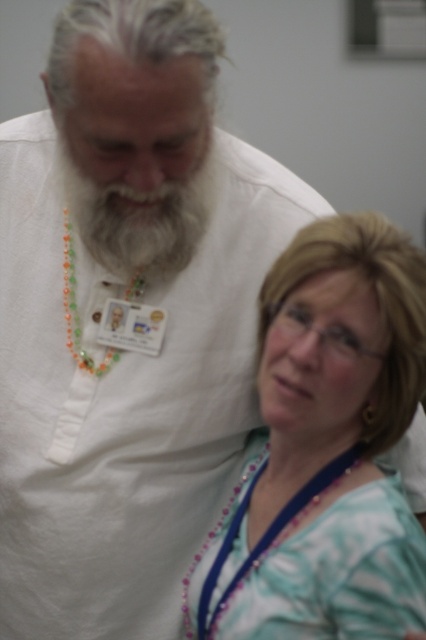
You are a photographer positioned in front of the two people in the image. You need to focus your camera on the teal striped shirt at lower right. Since the camera has a minimum focus distance of 36 inches, will you be able to capture the shirt clearly?

The teal striped shirt at lower right is 36.18 inches away from the viewer. Since the camera requires a minimum focus distance of 36 inches, the shirt is just slightly beyond the minimum distance, so the camera should be able to focus on it clearly.

You are trying to locate the teal striped shirt at lower right in the image. Which of the following coordinates would you look at? Choose from the options below. Options are point A at 0.603, 0.768, point B at (327, 449), point C at 0.703, 0.868, or point D at 0.803, 0.768.

The point B at (327, 449) is on the teal striped shirt at lower right, so you should look at point B.